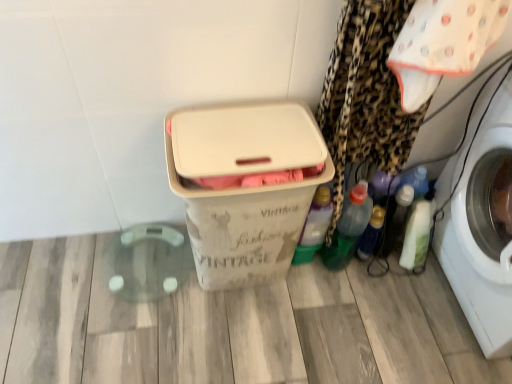
Question: Is translucent plastic bottle at lower right, the second bottle in the right-to-left sequence, smaller than white cotton cloth at upper right?

Choices:
 (A) yes
 (B) no

Answer: (A)

Question: Are translucent plastic bottle at lower right, the 3th bottle positioned from the left, and white cotton cloth at upper right beside each other?

Choices:
 (A) yes
 (B) no

Answer: (B)

Question: From a real-world perspective, is translucent plastic bottle at lower right, the second bottle in the right-to-left sequence, physically below white cotton cloth at upper right?

Choices:
 (A) no
 (B) yes

Answer: (B)

Question: Does translucent plastic bottle at lower right, the 3th bottle positioned from the left, appear on the left side of white cotton cloth at upper right?

Choices:
 (A) no
 (B) yes

Answer: (B)

Question: Can you confirm if translucent plastic bottle at lower right, the second bottle in the right-to-left sequence, is shorter than white cotton cloth at upper right?

Choices:
 (A) yes
 (B) no

Answer: (A)

Question: From a real-world perspective, relative to green translucent bottle at center-right, which is counted as the fourth bottle, starting from the right, is green plastic bottle at lower right, marked as the second bottle in a left-to-right arrangement, vertically above or below?

Choices:
 (A) below
 (B) above

Answer: (A)

Question: Is point (340, 218) closer or farther from the camera than point (315, 236)?

Choices:
 (A) closer
 (B) farther

Answer: (A)

Question: Considering the positions of green plastic bottle at lower right, marked as the second bottle in a left-to-right arrangement, and green translucent bottle at center-right, which is counted as the fourth bottle, starting from the right, in the image, is green plastic bottle at lower right, marked as the second bottle in a left-to-right arrangement, bigger or smaller than green translucent bottle at center-right, which is counted as the fourth bottle, starting from the right,?

Choices:
 (A) small
 (B) big

Answer: (B)

Question: In the image, is green plastic bottle at lower right, the 3th bottle viewed from the right, positioned in front of or behind green translucent bottle at center-right, the first bottle positioned from the left?

Choices:
 (A) behind
 (B) front

Answer: (A)

Question: Is white cotton cloth at upper right in front of or behind translucent plastic bottle at lower right, the 3th bottle positioned from the left, in the image?

Choices:
 (A) front
 (B) behind

Answer: (A)

Question: Does point (437, 76) appear closer or farther from the camera than point (368, 238)?

Choices:
 (A) closer
 (B) farther

Answer: (A)

Question: Is white cotton cloth at upper right spatially inside translucent plastic bottle at lower right, the second bottle in the right-to-left sequence, or outside of it?

Choices:
 (A) inside
 (B) outside

Answer: (B)

Question: Looking at the image, does white cotton cloth at upper right seem bigger or smaller compared to translucent plastic bottle at lower right, the second bottle in the right-to-left sequence?

Choices:
 (A) small
 (B) big

Answer: (B)

Question: Considering the positions of green translucent bottle at center-right, the first bottle positioned from the left, and translucent plastic bottle at lower right, the second bottle in the right-to-left sequence, in the image, is green translucent bottle at center-right, the first bottle positioned from the left, taller or shorter than translucent plastic bottle at lower right, the second bottle in the right-to-left sequence,?

Choices:
 (A) short
 (B) tall

Answer: (B)

Question: Which is correct: green translucent bottle at center-right, which is counted as the fourth bottle, starting from the right, is inside translucent plastic bottle at lower right, the 3th bottle positioned from the left, or outside of it?

Choices:
 (A) outside
 (B) inside

Answer: (A)